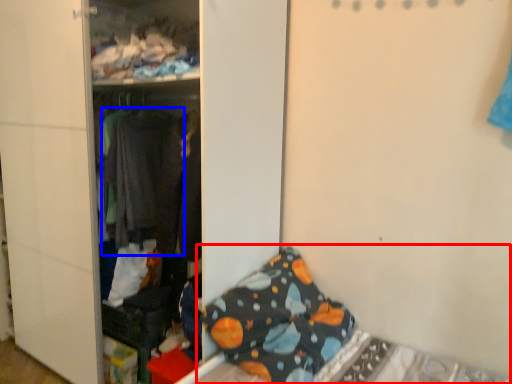
Question: Which object is closer to the camera taking this photo, bed (highlighted by a red box) or clothing (highlighted by a blue box)?

Choices:
 (A) bed
 (B) clothing

Answer: (A)